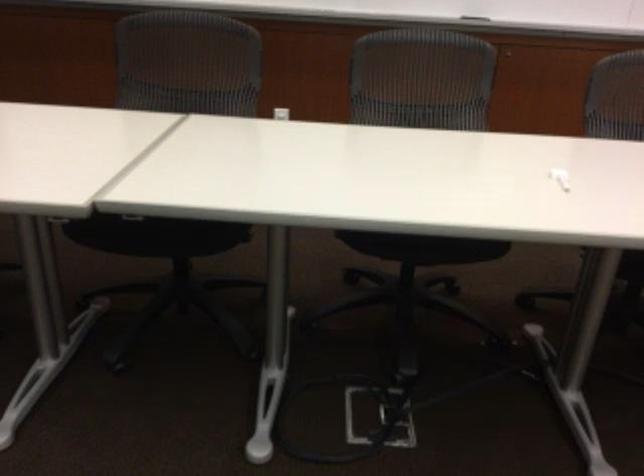
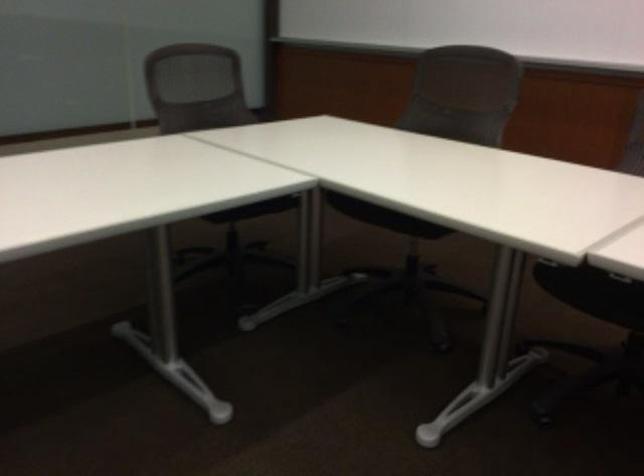
The point at [128,228] is marked in the first image. Where is the corresponding point in the second image?

(592, 292)